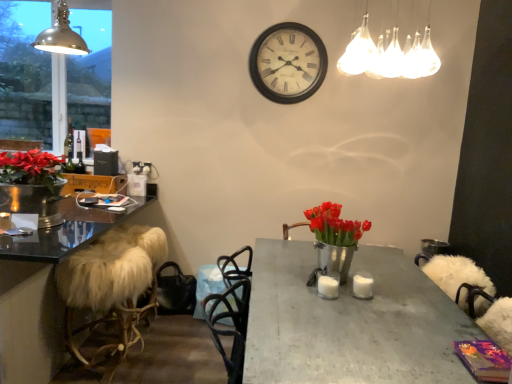
Question: From the image's perspective, is metallic dome lamp at upper left, placed as the 1th lamp when sorted from back to front, located above metallic gray table at center?

Choices:
 (A) no
 (B) yes

Answer: (B)

Question: Is metallic dome lamp at upper left, which is the 1th lamp from left to right, oriented away from metallic gray table at center?

Choices:
 (A) yes
 (B) no

Answer: (B)

Question: Is metallic gray table at center inside metallic dome lamp at upper left, which is the 1th lamp from left to right?

Choices:
 (A) no
 (B) yes

Answer: (A)

Question: Would you consider metallic dome lamp at upper left, which is the 1th lamp from left to right, to be distant from metallic gray table at center?

Choices:
 (A) no
 (B) yes

Answer: (B)

Question: Considering the relative positions of metallic dome lamp at upper left, the 2th lamp in the right-to-left sequence, and metallic gray table at center in the image provided, is metallic dome lamp at upper left, the 2th lamp in the right-to-left sequence, to the right of metallic gray table at center from the viewer's perspective?

Choices:
 (A) yes
 (B) no

Answer: (B)

Question: Does metallic dome lamp at upper left, placed as the 1th lamp when sorted from back to front, have a smaller size compared to metallic gray table at center?

Choices:
 (A) yes
 (B) no

Answer: (A)

Question: Is translucent glass light fixture at upper center, positioned as the 2th lamp in left-to-right order, looking in the opposite direction of white fur-covered stool at left?

Choices:
 (A) no
 (B) yes

Answer: (A)

Question: Can you confirm if translucent glass light fixture at upper center, positioned as the 2th lamp in left-to-right order, is wider than white fur-covered stool at left?

Choices:
 (A) no
 (B) yes

Answer: (A)

Question: Is there a large distance between translucent glass light fixture at upper center, positioned as the 1th lamp in right-to-left order, and white fur-covered stool at left?

Choices:
 (A) yes
 (B) no

Answer: (A)

Question: Is the surface of translucent glass light fixture at upper center, which is counted as the second lamp, starting from the back, in direct contact with white fur-covered stool at left?

Choices:
 (A) no
 (B) yes

Answer: (A)

Question: Does translucent glass light fixture at upper center, which is counted as the second lamp, starting from the back, appear on the right side of white fur-covered stool at left?

Choices:
 (A) yes
 (B) no

Answer: (A)

Question: Is translucent glass light fixture at upper center, positioned as the 1th lamp in right-to-left order, taller than white fur-covered stool at left?

Choices:
 (A) no
 (B) yes

Answer: (A)

Question: Can you confirm if metallic glass window at upper left is shorter than metallic dome lamp at upper left, the 2th lamp in the right-to-left sequence?

Choices:
 (A) yes
 (B) no

Answer: (B)